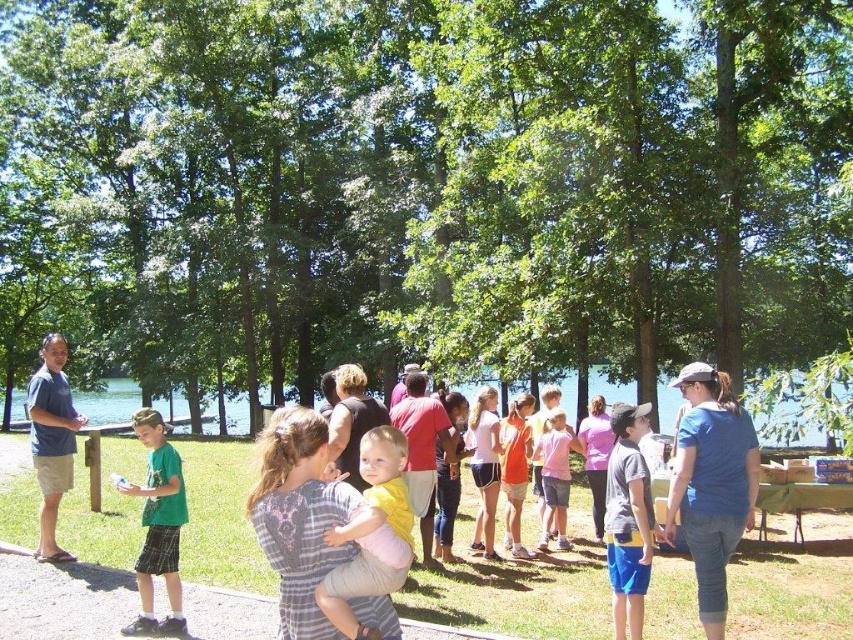
Question: Which point is farther to the camera?

Choices:
 (A) [64, 472]
 (B) [144, 518]
 (C) [460, 388]
 (D) [548, 422]

Answer: (C)

Question: In this image, where is matte blue shirt at left located relative to pink cotton shirt at center?

Choices:
 (A) below
 (B) above

Answer: (B)

Question: Which object appears farthest from the camera in this image?

Choices:
 (A) gray cotton t-shirt at center
 (B) green matte shirt at left

Answer: (B)

Question: Is green matte shirt at left wider than matte blue shirt at left?

Choices:
 (A) no
 (B) yes

Answer: (A)

Question: Where is yellow fabric shirt at center located in relation to clear blue water at center in the image?

Choices:
 (A) above
 (B) below

Answer: (A)

Question: Which of the following is the closest to the observer?

Choices:
 (A) (364, 458)
 (B) (543, 536)

Answer: (A)